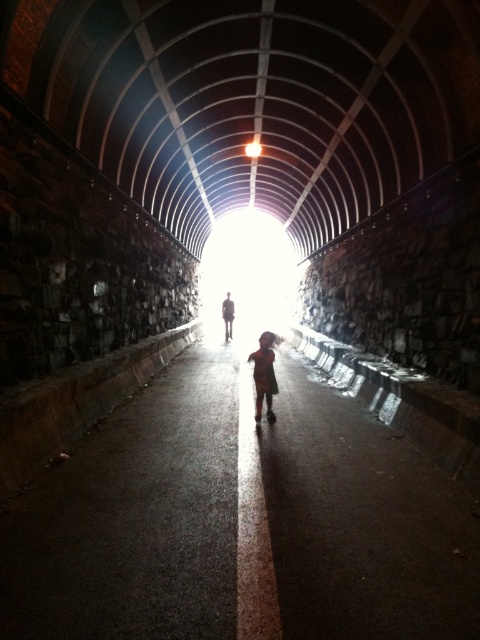
Which is more to the right, silhouette figure at center or bright white light at center?

bright white light at center is more to the right.

Can you confirm if silhouette figure at center is thinner than bright white light at center?

Correct, silhouette figure at center's width is less than bright white light at center's.

Find the location of a particular element. This screenshot has height=640, width=480. silhouette figure at center is located at coordinates (228, 316).

Does dark brown fabric child at center have a larger size compared to bright white light at center?

Yes.

How much distance is there between dark brown fabric child at center and bright white light at center?

They are 11.67 meters apart.

At what (x,y) coordinates should I click in order to perform the action: click on dark brown fabric child at center. Please return your answer as a coordinate pair (x, y). Looking at the image, I should click on (264, 374).

You are a GUI agent. You are given a task and a screenshot of the screen. Output one action in this format:
    pyautogui.click(x=<x>, y=<y>)
    Task: Click on the dark brown fabric child at center
    
    Given the screenshot: What is the action you would take?
    pyautogui.click(x=264, y=374)

Is dark brown fabric child at center positioned behind silhouette figure at center?

No.

Locate an element on the screen. Image resolution: width=480 pixels, height=640 pixels. dark brown fabric child at center is located at coordinates (264, 374).